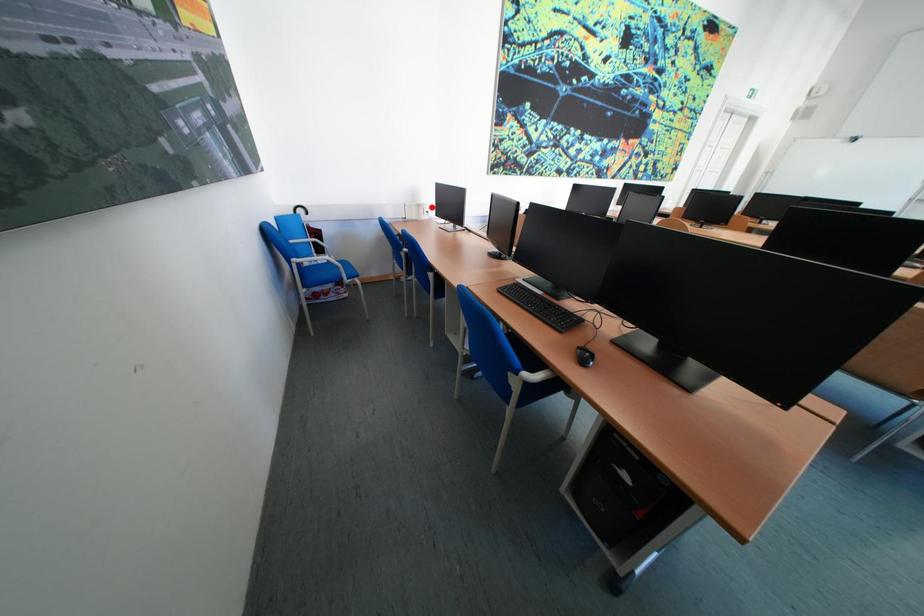
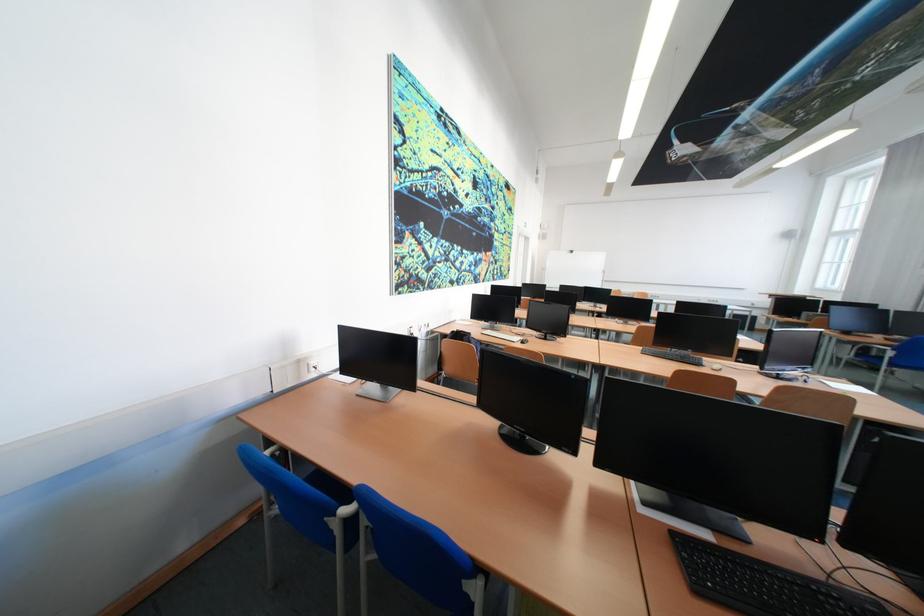
Locate, in the second image, the point that corresponds to the highlighted location in the first image.

(311, 363)